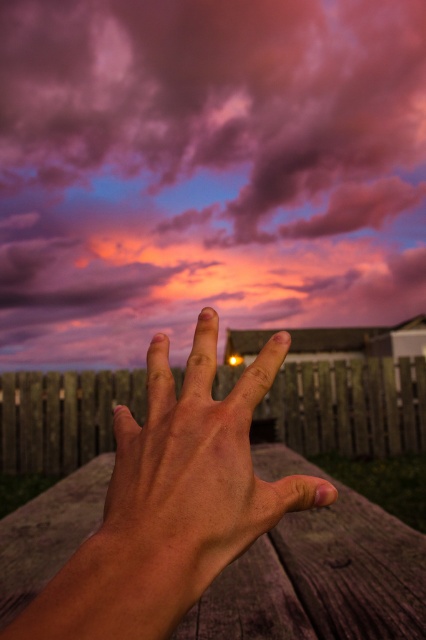
Is pink cotton candy cloud at upper center behind wooden picnic table at center?

That is False.

This screenshot has width=426, height=640. I want to click on pink cotton candy cloud at upper center, so click(x=206, y=170).

Identify the location of pink cotton candy cloud at upper center. (206, 170).

Can you confirm if wooden picnic table at center is wider than smooth skin hand at center?

Yes.

Which is in front, point (69, 518) or point (192, 413)?

Point (192, 413) is in front.

Is point (325, 474) closer to camera compared to point (284, 492)?

No, (325, 474) is behind (284, 492).

You are a GUI agent. You are given a task and a screenshot of the screen. Output one action in this format:
    pyautogui.click(x=<x>, y=<y>)
    Task: Click on the wooden picnic table at center
    Image resolution: width=426 pixels, height=640 pixels.
    Given the screenshot: What is the action you would take?
    pyautogui.click(x=317, y=572)

Does pink cotton candy cloud at upper center have a greater height compared to smooth skin hand at center?

Yes.

Is pink cotton candy cloud at upper center below smooth skin hand at center?

Actually, pink cotton candy cloud at upper center is above smooth skin hand at center.

The image size is (426, 640). What do you see at coordinates (206, 170) in the screenshot? I see `pink cotton candy cloud at upper center` at bounding box center [206, 170].

The width and height of the screenshot is (426, 640). In order to click on pink cotton candy cloud at upper center in this screenshot , I will do `click(206, 170)`.